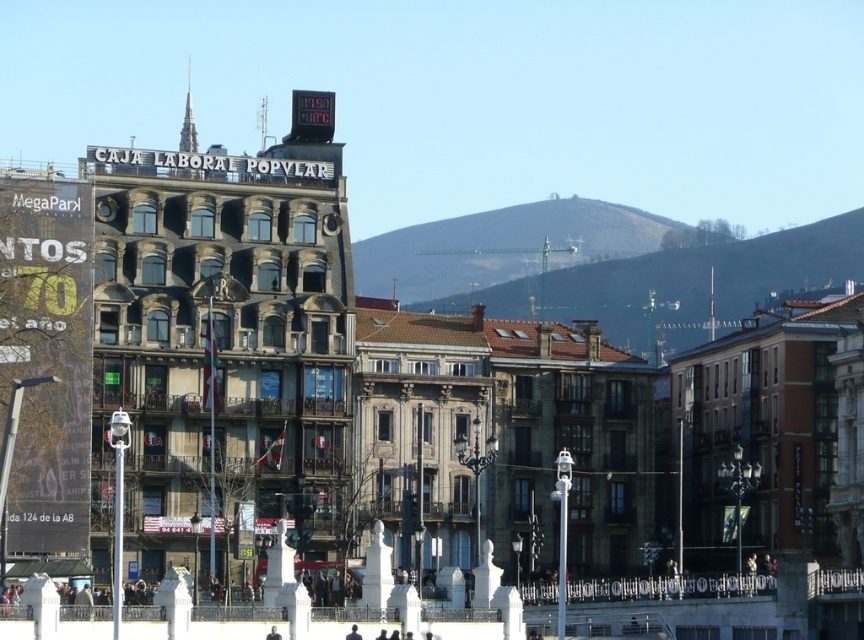
Looking at this image, you are a tourist in this city and want to take a photo of the dark brown leather jacket at center without the metallic digital clock at center appearing in the frame. Is it possible to do so while keeping both in the same line of sight?

The metallic digital clock at center is positioned over the dark brown leather jacket at center, so it would block the view of the jacket. Therefore, it is not possible to take a photo of the dark brown leather jacket at center without the metallic digital clock at center appearing in the frame while keeping both in the same line of sight.

You are a tourist standing in the middle of the street looking at the buildings. You see the metallic digital clock at center and the dark blue suit at center. Which object is higher up?

The metallic digital clock at center is located above the dark blue suit at center, so it is higher up.